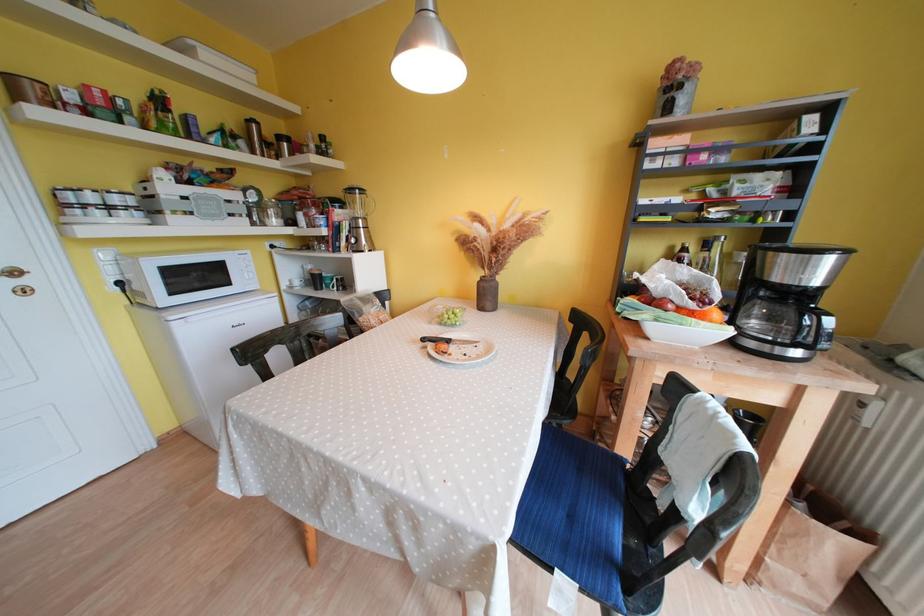
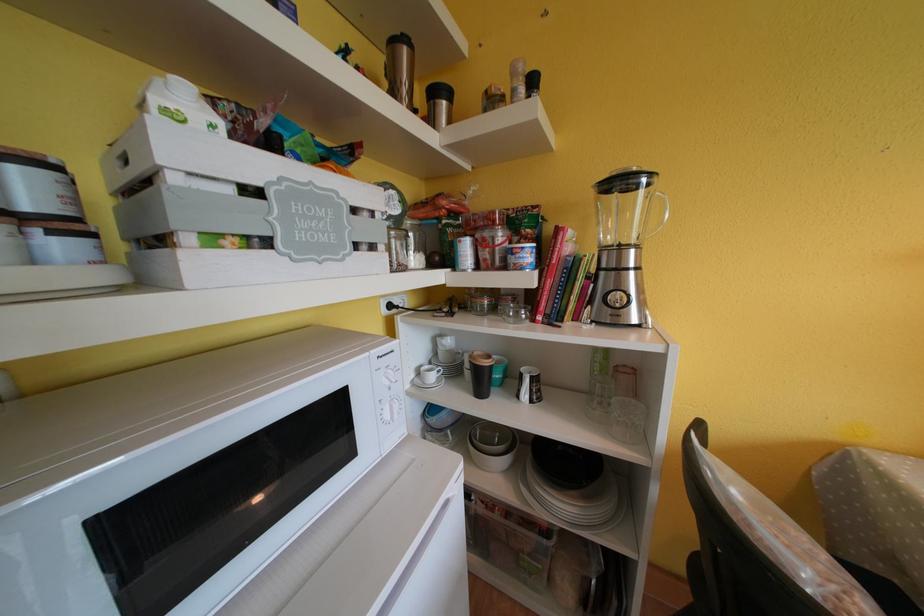
In a continuous first-person perspective shot, in which direction is the camera moving?

The movement direction of the cameraman is left, forward.